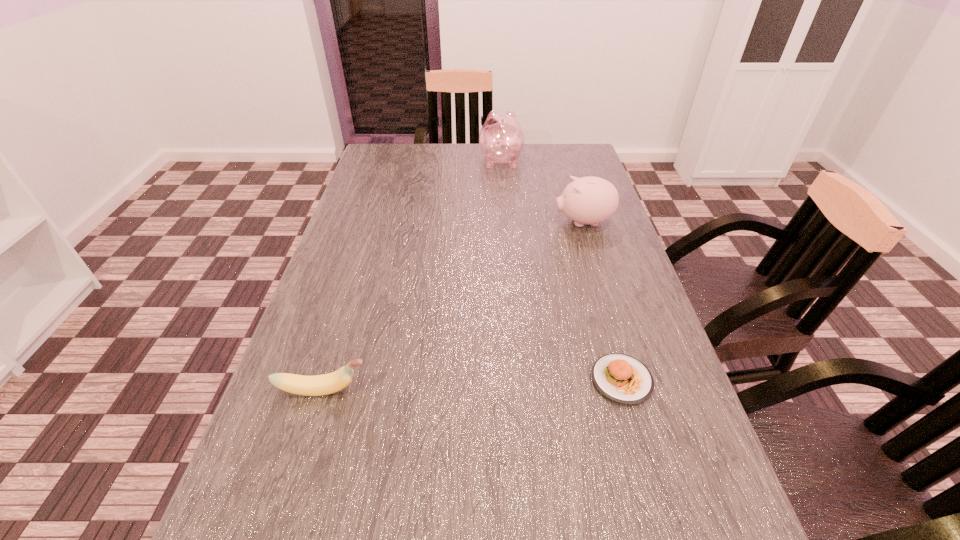
I want to click on vacant space located at the stem of the second shortest object, so click(x=502, y=390).

This screenshot has width=960, height=540. Identify the location of blank space located 0.240m on the left of the food. (468, 380).

Locate an element on the screen. This screenshot has height=540, width=960. object at the far edge is located at coordinates tap(501, 139).

In order to click on object present at the left edge in this screenshot , I will do `click(318, 385)`.

Find the location of a particular element. The height and width of the screenshot is (540, 960). piggy bank that is positioned at the right edge is located at coordinates (590, 200).

This screenshot has height=540, width=960. In order to click on food located at the right edge in this screenshot , I will do `click(622, 378)`.

The image size is (960, 540). I want to click on vacant space at the far edge of the desktop, so click(x=532, y=157).

Identify the location of vacant area at the left edge of the desktop. The width and height of the screenshot is (960, 540). (256, 446).

This screenshot has width=960, height=540. In order to click on vacant position at the right edge of the desktop in this screenshot , I will do `click(628, 303)`.

In order to click on free space at the far right corner in this screenshot , I will do click(x=570, y=163).